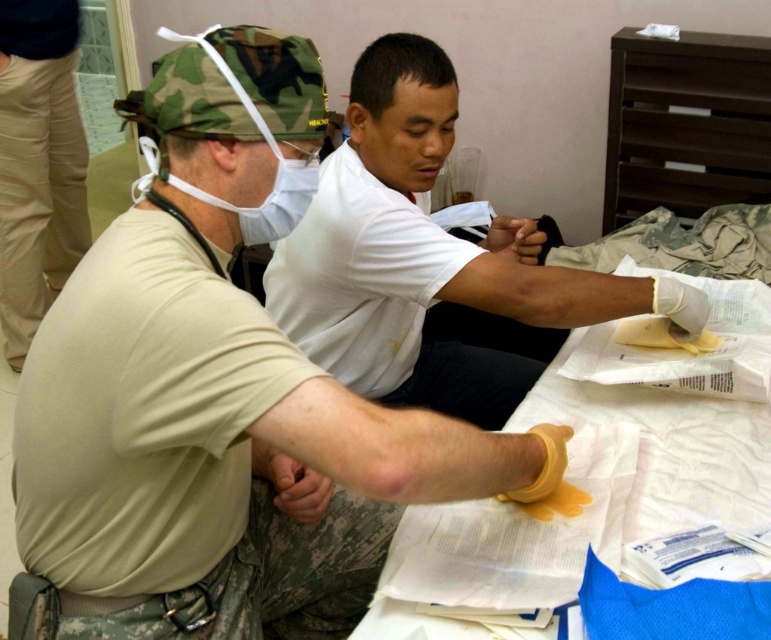
You are a nurse in a hospital and need to locate the yellow rubber glove at lower center and the tan cotton pants at lower left. According to the scene, which object is positioned to the right of the other?

The yellow rubber glove at lower center is to the right of tan cotton pants at lower left.

You are a nurse in a hospital. You need to check if the yellow rubber glove at lower center is accessible without moving the tan cotton pants at lower left. Can you reach it?

The yellow rubber glove at lower center is positioned under tan cotton pants at lower left, so you cannot reach it without moving the tan cotton pants at lower left.

What is the exact coordinate of the yellow rubber glove at lower center in the image?

The yellow rubber glove at lower center is located at point [217,394].